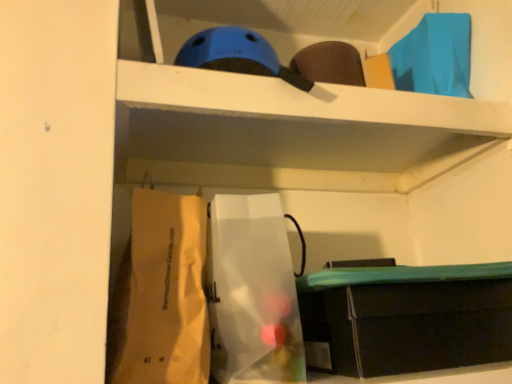
Question: Based on their positions, is translucent plastic bag at center, the first paper bag when ordered from right to left, located to the left or right of white paper bag at lower left, arranged as the 2th paper bag when viewed from the right?

Choices:
 (A) left
 (B) right

Answer: (B)

Question: Is translucent plastic bag at center, the second paper bag viewed from the left, inside or outside of white paper bag at lower left, marked as the 1th paper bag in a left-to-right arrangement?

Choices:
 (A) inside
 (B) outside

Answer: (B)

Question: Which of these objects is positioned farthest from the white paper bag at lower left, arranged as the 2th paper bag when viewed from the right?

Choices:
 (A) translucent plastic bag at center, the first paper bag when ordered from right to left
 (B) matte black storage box at lower right

Answer: (B)

Question: Which object is positioned farthest from the white paper bag at lower left, marked as the 1th paper bag in a left-to-right arrangement?

Choices:
 (A) translucent plastic bag at center, the second paper bag viewed from the left
 (B) matte black storage box at lower right

Answer: (B)